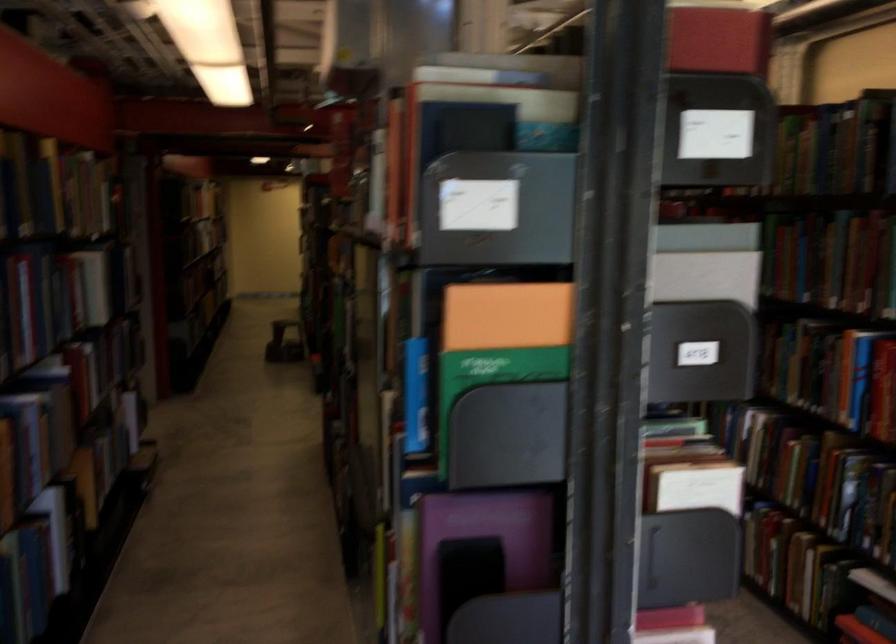
This screenshot has height=644, width=896. What are the coordinates of `blue book` in the screenshot? It's located at (416, 395).